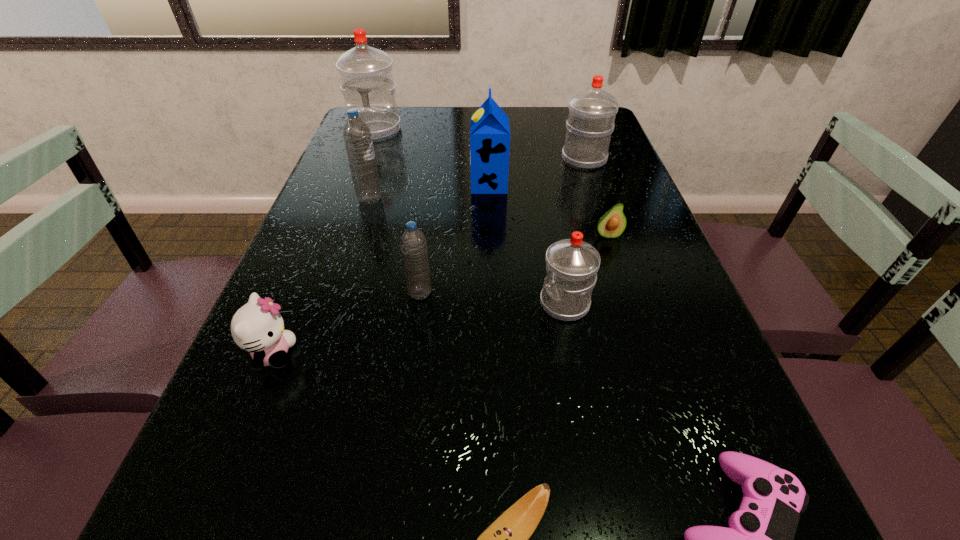
This screenshot has height=540, width=960. Identify the location of the tallest object. (366, 75).

Locate an element on the screen. This screenshot has width=960, height=540. the biggest white water bottle is located at coordinates (366, 75).

Where is `carton`? Image resolution: width=960 pixels, height=540 pixels. carton is located at coordinates (489, 129).

Where is `the rightmost white water bottle`? the rightmost white water bottle is located at coordinates (591, 117).

The height and width of the screenshot is (540, 960). I want to click on the second nearest white water bottle, so (x=591, y=117).

At what (x,y) coordinates should I click in order to perform the action: click on the farther blue water bottle. Please return your answer as a coordinate pair (x, y). This screenshot has width=960, height=540. Looking at the image, I should click on (357, 137).

At what (x,y) coordinates should I click in order to perform the action: click on the third nearest water bottle. Please return your answer as a coordinate pair (x, y). This screenshot has height=540, width=960. Looking at the image, I should click on (357, 137).

Image resolution: width=960 pixels, height=540 pixels. In order to click on the fourth water bottle from left to right in this screenshot , I will do point(572,264).

What are the coordinates of `the seventh object from left to right` in the screenshot? It's located at (572, 264).

Image resolution: width=960 pixels, height=540 pixels. Find the location of `the seventh object from right to left`. the seventh object from right to left is located at coordinates (413, 243).